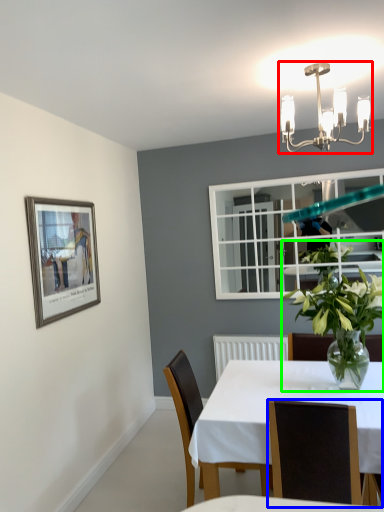
Question: Considering the real-world distances, which object is farthest from light fixture (highlighted by a red box)? chair (highlighted by a blue box) or houseplant (highlighted by a green box)?

Choices:
 (A) chair
 (B) houseplant

Answer: (A)